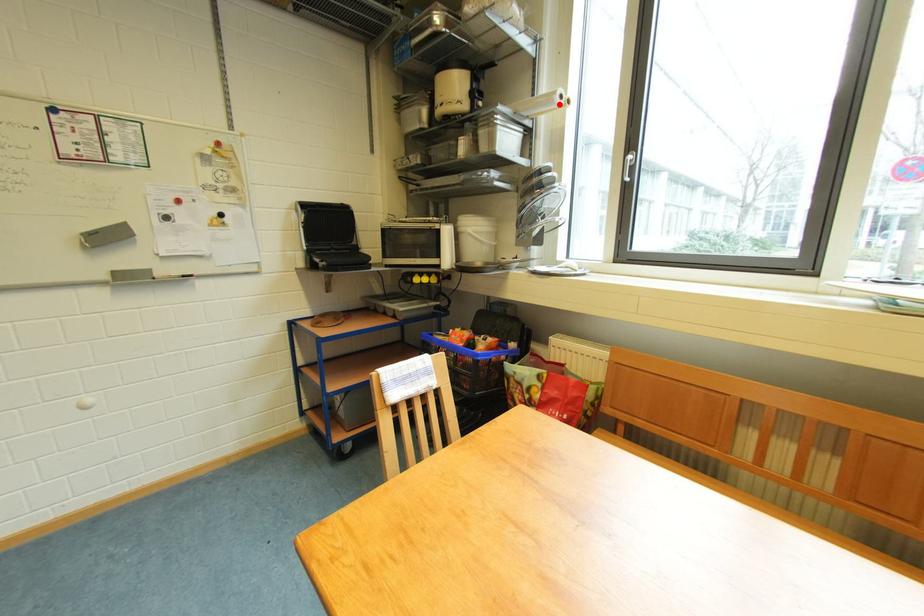
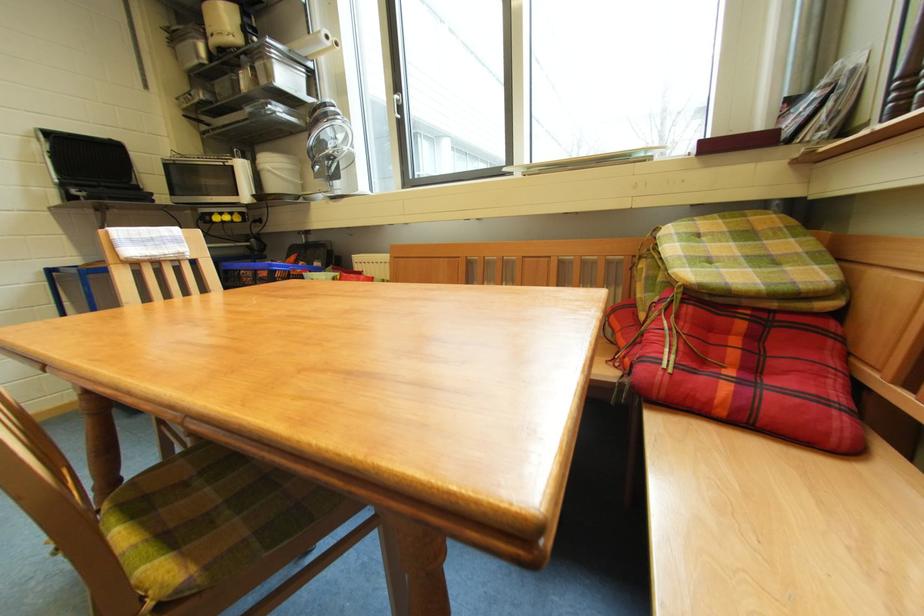
In the second image, find the point that corresponds to the highlighted location in the first image.

(326, 44)